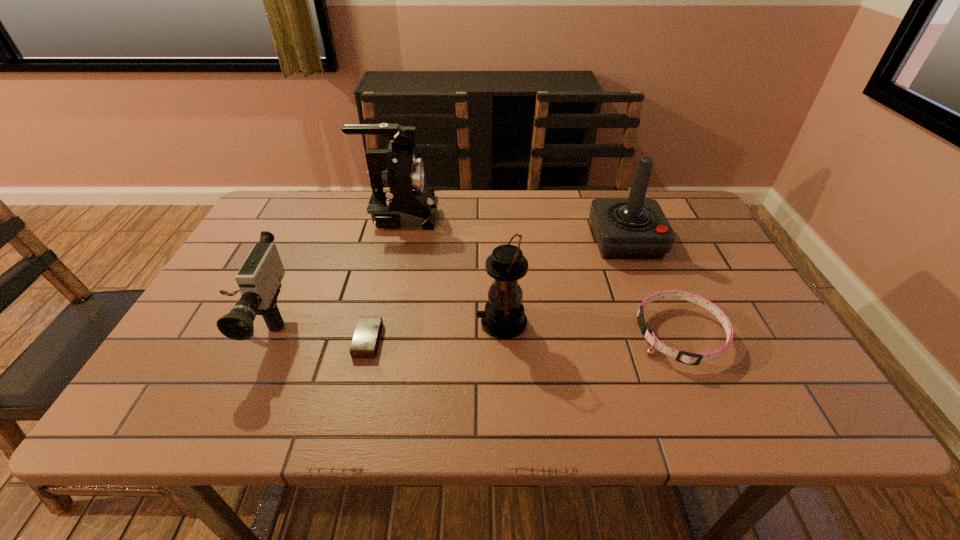
The image size is (960, 540). I want to click on the farther camcorder, so click(401, 197).

I want to click on the taller camcorder, so click(401, 197).

At what (x,y) coordinates should I click in order to perform the action: click on joystick. Please return your answer as a coordinate pair (x, y). Looking at the image, I should click on (635, 228).

Locate an element on the screen. The image size is (960, 540). lantern is located at coordinates (504, 318).

In order to click on the third shortest object in this screenshot , I will do `click(259, 279)`.

This screenshot has height=540, width=960. Identify the location of the shorter camcorder. (259, 279).

This screenshot has width=960, height=540. Find the location of `the fifth tallest object`. the fifth tallest object is located at coordinates (695, 358).

Find the location of `alarm clock`. alarm clock is located at coordinates (365, 342).

Locate an element on the screen. Image resolution: width=960 pixels, height=540 pixels. free spot located 0.200m on the lens mount of the right camcorder is located at coordinates (505, 217).

This screenshot has width=960, height=540. Identify the location of free space located on the front-facing side of the joystick. (664, 337).